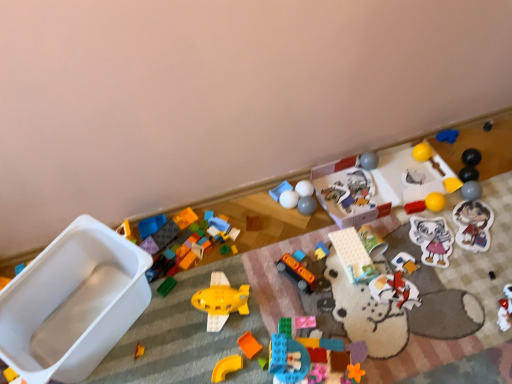
Find the location of a particular element. This screenshot has width=512, height=384. blank space to the left of white plastic toy at center, which is the seventeenth toy from left to right is located at coordinates (296, 210).